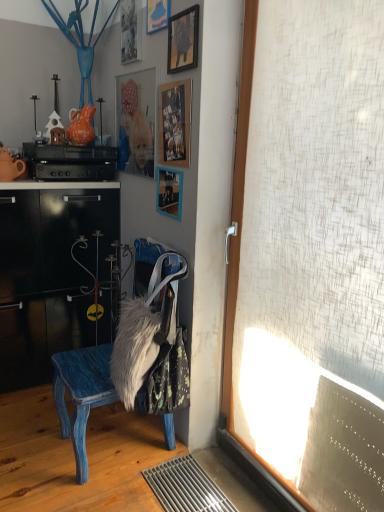
How much space does wooden picture frame at upper center, placed as the 1th picture frame when sorted from bottom to top, occupy vertically?

wooden picture frame at upper center, placed as the 1th picture frame when sorted from bottom to top, is 8.88 inches tall.

Describe the element at coordinates (130, 30) in the screenshot. I see `metallic silver picture frame at upper center, marked as the 4th picture frame in a bottom-to-top arrangement` at that location.

I want to click on wooden picture frame at upper center, positioned as the third picture frame in bottom-to-top order, so click(x=183, y=40).

Describe the element at coordinates (81, 394) in the screenshot. I see `blue painted wood chair at center` at that location.

What do you see at coordinates (81, 126) in the screenshot? The width and height of the screenshot is (384, 512). I see `orange glazed teapot at upper center, acting as the 2th teapot starting from the bottom` at bounding box center [81, 126].

Where is `wooden picture frame at upper center, arranged as the fifth picture frame when viewed from the top`? The width and height of the screenshot is (384, 512). wooden picture frame at upper center, arranged as the fifth picture frame when viewed from the top is located at coordinates (169, 192).

Could you measure the distance between wooden picture frame at upper center, placed as the 1th picture frame when sorted from bottom to top, and blonde hair doll at upper center?

The distance of wooden picture frame at upper center, placed as the 1th picture frame when sorted from bottom to top, from blonde hair doll at upper center is 32.83 centimeters.

From the image's perspective, relative to blonde hair doll at upper center, is wooden picture frame at upper center, arranged as the fifth picture frame when viewed from the top, above or below?

Clearly, from the image's perspective, wooden picture frame at upper center, arranged as the fifth picture frame when viewed from the top, is below blonde hair doll at upper center.

From a real-world perspective, between wooden picture frame at upper center, placed as the 1th picture frame when sorted from bottom to top, and blonde hair doll at upper center, who is vertically lower?

In real-world perspective, wooden picture frame at upper center, placed as the 1th picture frame when sorted from bottom to top, is lower.

Can blonde hair doll at upper center be found inside wooden picture frame at upper center, placed as the 1th picture frame when sorted from bottom to top?

No, blonde hair doll at upper center is not inside wooden picture frame at upper center, placed as the 1th picture frame when sorted from bottom to top.

Is orange glazed teapot at upper center, marked as the 1th teapot in a right-to-left arrangement, smaller than matte blue picture frame at upper center, the 1th picture frame from the top?

No.

From a real-world perspective, is orange glazed teapot at upper center, acting as the 2th teapot starting from the bottom, physically located above or below matte blue picture frame at upper center, placed as the 5th picture frame when sorted from bottom to top?

In terms of real-world spatial position, orange glazed teapot at upper center, acting as the 2th teapot starting from the bottom, is below matte blue picture frame at upper center, placed as the 5th picture frame when sorted from bottom to top.

The width and height of the screenshot is (384, 512). In order to click on the 3rd picture frame in front when counting from the orange glazed teapot at upper center, marked as the 1th teapot in a right-to-left arrangement in this screenshot , I will do `click(157, 15)`.

How distant is orange glazed teapot at upper center, which appears as the first teapot when viewed from the top, from matte blue picture frame at upper center, placed as the 5th picture frame when sorted from bottom to top?

orange glazed teapot at upper center, which appears as the first teapot when viewed from the top, is 27.10 inches from matte blue picture frame at upper center, placed as the 5th picture frame when sorted from bottom to top.

Is fuzzy fabric bag at lower center not near wooden photo frame at upper center, which is the second picture frame from bottom to top?

Actually, fuzzy fabric bag at lower center and wooden photo frame at upper center, which is the second picture frame from bottom to top, are a little close together.

From a real-world perspective, starting from the fuzzy fabric bag at lower center, which picture frame is the 2nd one vertically above it? Please provide its 2D coordinates.

[(175, 123)]

Is wooden photo frame at upper center, which is the second picture frame from bottom to top, inside fuzzy fabric bag at lower center?

Definitely not — wooden photo frame at upper center, which is the second picture frame from bottom to top, is not inside fuzzy fabric bag at lower center.

Which point is more forward, [166,377] or [177,143]?

The point [166,377] is closer to the camera.

Looking at this image, can you confirm if metallic silver picture frame at upper center, marked as the 4th picture frame in a bottom-to-top arrangement, is smaller than white textured screen at right?

Yes, metallic silver picture frame at upper center, marked as the 4th picture frame in a bottom-to-top arrangement, is smaller than white textured screen at right.

Is metallic silver picture frame at upper center, the second picture frame when ordered from top to bottom, positioned with its back to white textured screen at right?

No, metallic silver picture frame at upper center, the second picture frame when ordered from top to bottom, is not facing the opposite direction of white textured screen at right.

Is point (133, 19) positioned behind point (308, 275)?

That is True.

From the image's perspective, between metallic silver picture frame at upper center, marked as the 4th picture frame in a bottom-to-top arrangement, and white textured screen at right, which one is located above?

metallic silver picture frame at upper center, marked as the 4th picture frame in a bottom-to-top arrangement.

From a real-world perspective, is white textured screen at right beneath blue painted wood chair at center?

No, from a real-world perspective, white textured screen at right is not beneath blue painted wood chair at center.

Between white textured screen at right and blue painted wood chair at center, which one appears on the right side from the viewer's perspective?

Positioned to the right is white textured screen at right.

Is white textured screen at right looking in the opposite direction of blue painted wood chair at center?

That's not correct — white textured screen at right is not looking away from blue painted wood chair at center.

Considering the sizes of objects white textured screen at right and blue painted wood chair at center in the image provided, who is taller, white textured screen at right or blue painted wood chair at center?

With more height is white textured screen at right.

Which object is closer to the camera taking this photo, wooden picture frame at upper center, arranged as the 3th picture frame when viewed from the top, or blonde hair doll at upper center?

Positioned in front is wooden picture frame at upper center, arranged as the 3th picture frame when viewed from the top.

From their relative heights in the image, would you say wooden picture frame at upper center, arranged as the 3th picture frame when viewed from the top, is taller or shorter than blonde hair doll at upper center?

In the image, wooden picture frame at upper center, arranged as the 3th picture frame when viewed from the top, appears to be shorter than blonde hair doll at upper center.

How much distance is there between wooden picture frame at upper center, positioned as the third picture frame in bottom-to-top order, and blonde hair doll at upper center?

17.34 inches.

From the image's perspective, which one is positioned lower, wooden picture frame at upper center, positioned as the third picture frame in bottom-to-top order, or blonde hair doll at upper center?

blonde hair doll at upper center.

Which object is wider, wooden picture frame at upper center, positioned as the third picture frame in bottom-to-top order, or wooden photo frame at upper center, the 4th picture frame positioned from the top?

→ wooden picture frame at upper center, positioned as the third picture frame in bottom-to-top order.

Is wooden picture frame at upper center, arranged as the 3th picture frame when viewed from the top, next to wooden photo frame at upper center, which is the second picture frame from bottom to top, and touching it?

They are not placed beside each other.

Where is `person on the left of wooden picture frame at upper center, arranged as the fifth picture frame when viewed from the top`? The image size is (384, 512). person on the left of wooden picture frame at upper center, arranged as the fifth picture frame when viewed from the top is located at coordinates (135, 134).

What are the coordinates of `teapot that is the 1st one below the matte blue picture frame at upper center, placed as the 5th picture frame when sorted from bottom to top (from a real-world perspective)` in the screenshot? It's located at (81, 126).

Considering their positions, is metallic silver picture frame at upper center, the second picture frame when ordered from top to bottom, positioned closer to wooden picture frame at upper center, placed as the 1th picture frame when sorted from bottom to top, than fuzzy fabric bag at lower center?

The object closer to wooden picture frame at upper center, placed as the 1th picture frame when sorted from bottom to top, is fuzzy fabric bag at lower center.

Which object lies further to the anchor point matte blue picture frame at upper center, placed as the 5th picture frame when sorted from bottom to top, orange glazed teapot at upper center, acting as the 2th teapot starting from the bottom, or metallic silver picture frame at upper center, the second picture frame when ordered from top to bottom?

orange glazed teapot at upper center, acting as the 2th teapot starting from the bottom, is positioned further to the anchor matte blue picture frame at upper center, placed as the 5th picture frame when sorted from bottom to top.

Consider the image. When comparing their distances from wooden photo frame at upper center, which is the second picture frame from bottom to top, does white textured screen at right or wooden picture frame at upper center, positioned as the third picture frame in bottom-to-top order, seem further?

white textured screen at right.

Estimate the real-world distances between objects in this image. Which object is further from fuzzy fabric bag at lower center, blue painted wood chair at center or white textured screen at right?

Among the two, white textured screen at right is located further to fuzzy fabric bag at lower center.

Which object lies nearer to the anchor point metallic silver picture frame at upper center, the second picture frame when ordered from top to bottom, wooden photo frame at upper center, the 4th picture frame positioned from the top, or wooden picture frame at upper center, positioned as the third picture frame in bottom-to-top order?

wooden picture frame at upper center, positioned as the third picture frame in bottom-to-top order, is positioned closer to the anchor metallic silver picture frame at upper center, the second picture frame when ordered from top to bottom.

Considering their positions, is metallic silver picture frame at upper center, marked as the 4th picture frame in a bottom-to-top arrangement, positioned further to blonde hair doll at upper center than white textured screen at right?

white textured screen at right is further to blonde hair doll at upper center.

From the picture: Considering their positions, is white textured screen at right positioned further to wooden picture frame at upper center, arranged as the fifth picture frame when viewed from the top, than orange glazed teapot at upper center, acting as the 2th teapot starting from the bottom?

white textured screen at right lies further to wooden picture frame at upper center, arranged as the fifth picture frame when viewed from the top, than the other object.

When comparing their distances from white textured screen at right, does matte blue picture frame at upper center, the 1th picture frame from the top, or wooden picture frame at upper center, placed as the 1th picture frame when sorted from bottom to top, seem closer?

wooden picture frame at upper center, placed as the 1th picture frame when sorted from bottom to top, is positioned closer to the anchor white textured screen at right.

Find the location of a particular element. The image size is (384, 512). appliance between blonde hair doll at upper center and fuzzy fabric bag at lower center from top to bottom is located at coordinates (70, 162).

This screenshot has width=384, height=512. I want to click on chair between white textured screen at right and black matte stereo at upper left from front to back, so click(81, 394).

Where is `appliance between metallic silver picture frame at upper center, the second picture frame when ordered from top to bottom, and wooden picture frame at upper center, placed as the 1th picture frame when sorted from bottom to top, vertically`? appliance between metallic silver picture frame at upper center, the second picture frame when ordered from top to bottom, and wooden picture frame at upper center, placed as the 1th picture frame when sorted from bottom to top, vertically is located at coordinates (70, 162).

Find the location of a particular element. The height and width of the screenshot is (512, 384). picture frame between metallic silver picture frame at upper center, marked as the 4th picture frame in a bottom-to-top arrangement, and blonde hair doll at upper center vertically is located at coordinates (183, 40).